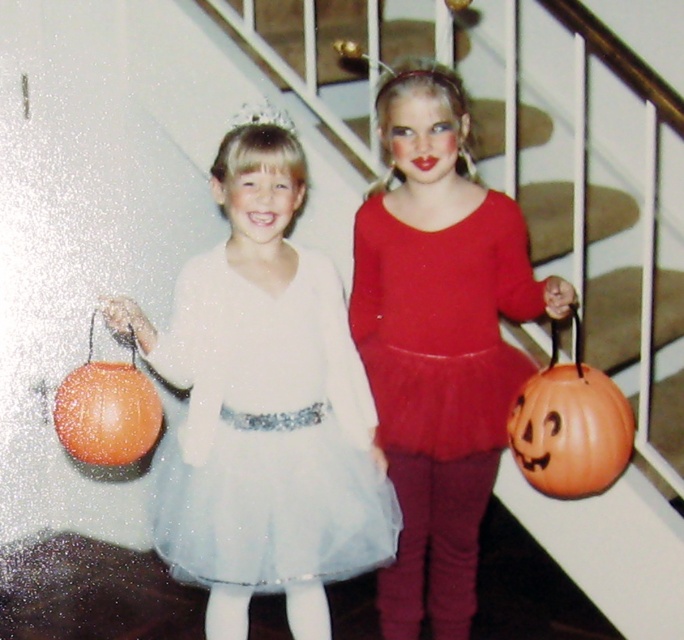
Question: Which of the following is the farthest from the observer?

Choices:
 (A) (410, 612)
 (B) (624, 406)

Answer: (A)

Question: Among these points, which one is nearest to the camera?

Choices:
 (A) (137, 445)
 (B) (393, 388)
 (C) (356, 445)
 (D) (423, 296)

Answer: (A)

Question: Is red tulle dress at center above orange matte pumpkin at right?

Choices:
 (A) no
 (B) yes

Answer: (B)

Question: Which is farther from the white tulle dress at center?

Choices:
 (A) red tulle dress at center
 (B) orange matte pumpkin at left

Answer: (B)

Question: Is matte red dress at center behind orange matte pumpkin at left?

Choices:
 (A) no
 (B) yes

Answer: (A)

Question: Does red tulle dress at center appear under orange matte pumpkin at left?

Choices:
 (A) no
 (B) yes

Answer: (A)